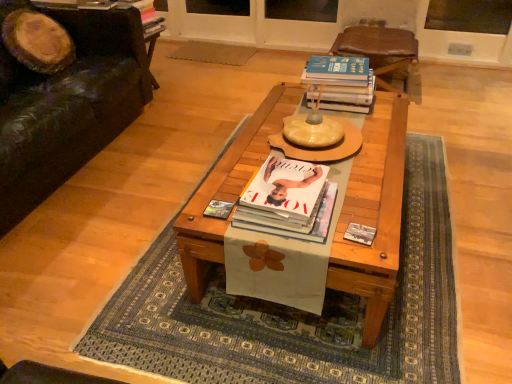
You are a GUI agent. You are given a task and a screenshot of the screen. Output one action in this format:
    pyautogui.click(x=<x>, y=<y>)
    Task: Click on the blank space above white glossy book at center, acting as the 2th book starting from the top (from a real-world perspective)
    
    Given the screenshot: What is the action you would take?
    pyautogui.click(x=278, y=183)